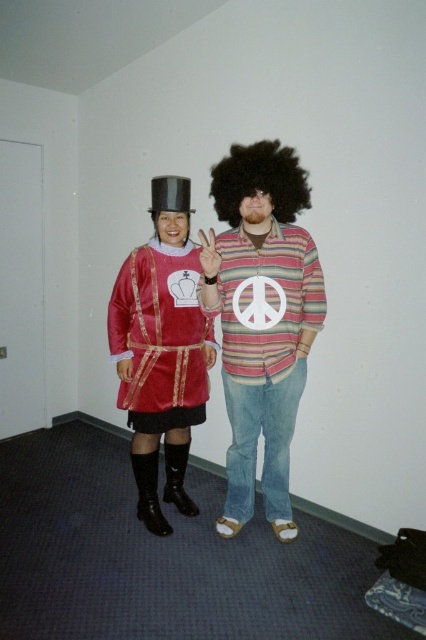
Does point (126, 307) come closer to viewer compared to point (305, 186)?

No, it is behind (305, 186).

Which is above, velvet red dress at left or afro at center?

afro at center is higher up.

Is point (127, 262) farther from camera compared to point (284, 152)?

Yes, it is.

At what (x,y) coordinates should I click in order to perform the action: click on velvet red dress at left. Please return your answer as a coordinate pair (x, y). Looking at the image, I should click on (161, 337).

Can you confirm if striped cotton shirt at center is taller than velvet red dress at left?

Yes, striped cotton shirt at center is taller than velvet red dress at left.

Is point (267, 262) behind point (172, 356)?

No, (267, 262) is in front of (172, 356).

This screenshot has height=640, width=426. Find the location of `striped cotton shirt at center`. striped cotton shirt at center is located at coordinates pos(261,320).

Is striped cotton shirt at center to the left of afro at center from the viewer's perspective?

Indeed, striped cotton shirt at center is positioned on the left side of afro at center.

Can you confirm if striped cotton shirt at center is shorter than afro at center?

No.

Is point (239, 419) farther from viewer compared to point (227, 216)?

Yes, point (239, 419) is behind point (227, 216).

The width and height of the screenshot is (426, 640). Identify the location of striped cotton shirt at center. tap(261, 320).